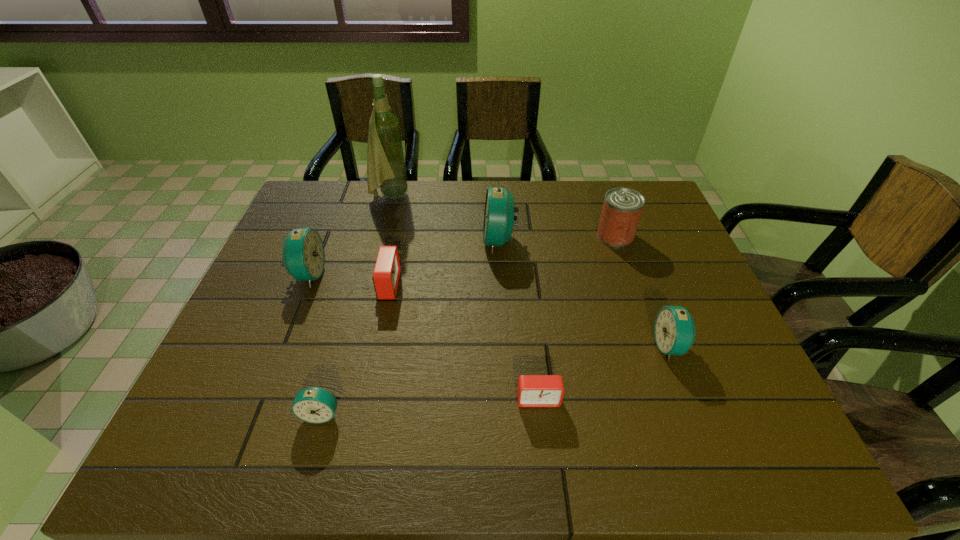
You are a GUI agent. You are given a task and a screenshot of the screen. Output one action in this format:
    pyautogui.click(x=<x>, y=<y>)
    Task: Click on the vacant point located between the can and the rightmost alarm clock
    This screenshot has width=960, height=540.
    Given the screenshot: What is the action you would take?
    pyautogui.click(x=642, y=291)

I want to click on free space between the bigger red alarm clock and the tallest alarm clock, so click(x=444, y=263).

The width and height of the screenshot is (960, 540). What are the coordinates of `free space between the can and the leftmost alarm clock` in the screenshot? It's located at (462, 255).

You are a GUI agent. You are given a task and a screenshot of the screen. Output one action in this format:
    pyautogui.click(x=<x>, y=<y>)
    Task: Click on the free area in between the right red alarm clock and the tallest object
    
    Given the screenshot: What is the action you would take?
    pyautogui.click(x=464, y=298)

The image size is (960, 540). What are the coordinates of `vacant region between the leftmost object and the fifth alarm clock from right to left` in the screenshot? It's located at (315, 344).

Find the location of a particular element. The height and width of the screenshot is (540, 960). unoccupied area between the third nearest alarm clock and the can is located at coordinates (642, 291).

Identify the location of free space between the second tallest object and the shortest alarm clock. Image resolution: width=960 pixels, height=540 pixels. (519, 320).

Identify which object is the second nearest to the second smallest blue alarm clock. Please provide its 2D coordinates. Your answer should be formatted as a tuple, i.e. [(x, y)], where the tuple contains the x and y coordinates of a point satisfying the conditions above.

[(622, 208)]

Image resolution: width=960 pixels, height=540 pixels. What are the coordinates of `object that ranks as the seventh closest to the can` in the screenshot? It's located at (316, 405).

Identify which alarm clock is located as the fifth nearest to the farther red alarm clock. Please provide its 2D coordinates. Your answer should be formatted as a tuple, i.e. [(x, y)], where the tuple contains the x and y coordinates of a point satisfying the conditions above.

[(674, 329)]